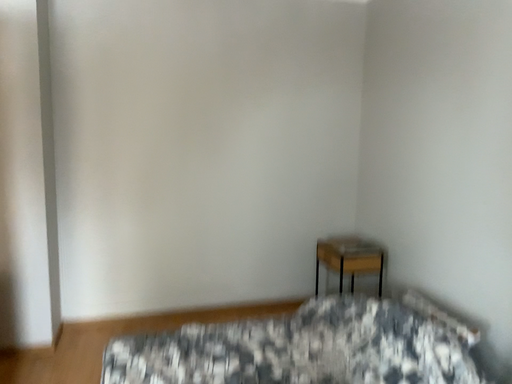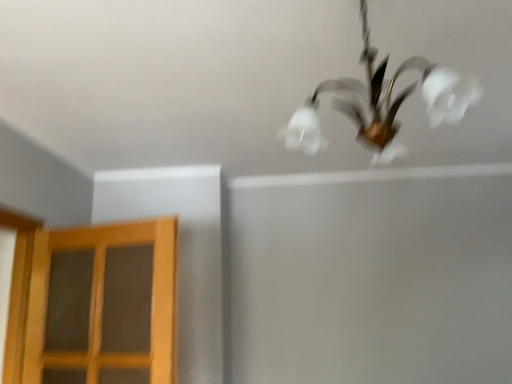
Question: How did the camera likely rotate when shooting the video?

Choices:
 (A) rotated downward
 (B) rotated upward

Answer: (B)